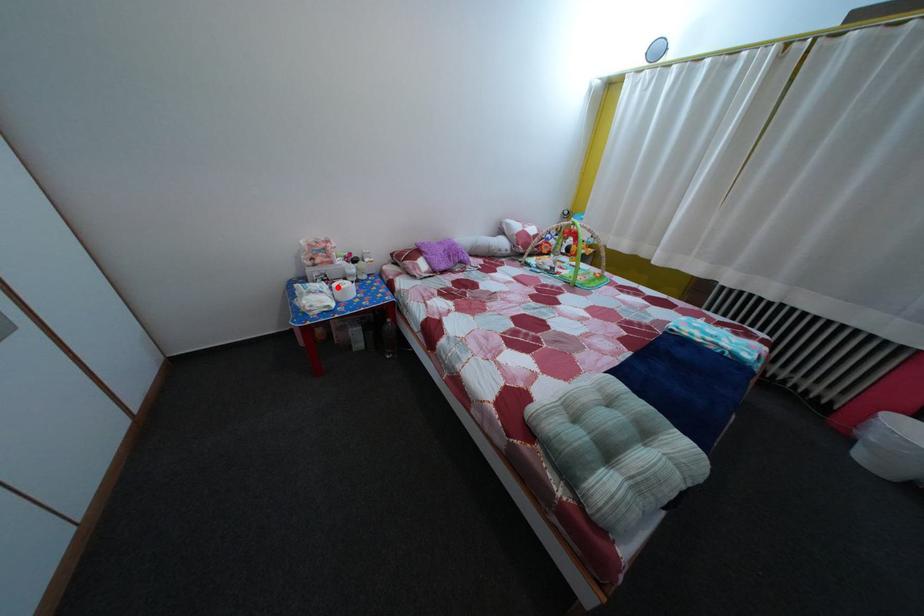
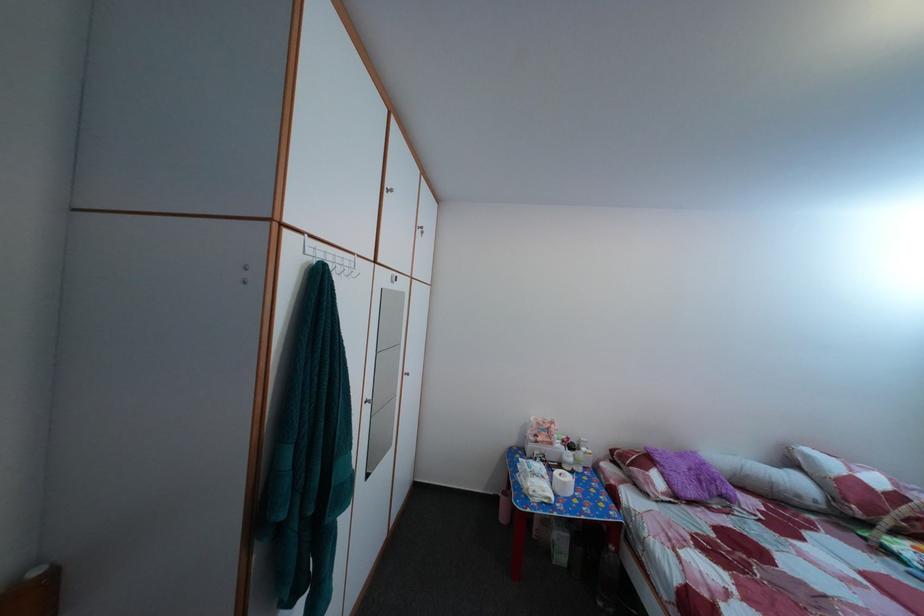
Question: I am providing you with two images of the same scene from different viewpoints. A red point is shown in image1. For the corresponding object point in image2, is it positioned nearer or farther from the camera?

Choices:
 (A) Nearer
 (B) Farther

Answer: (B)